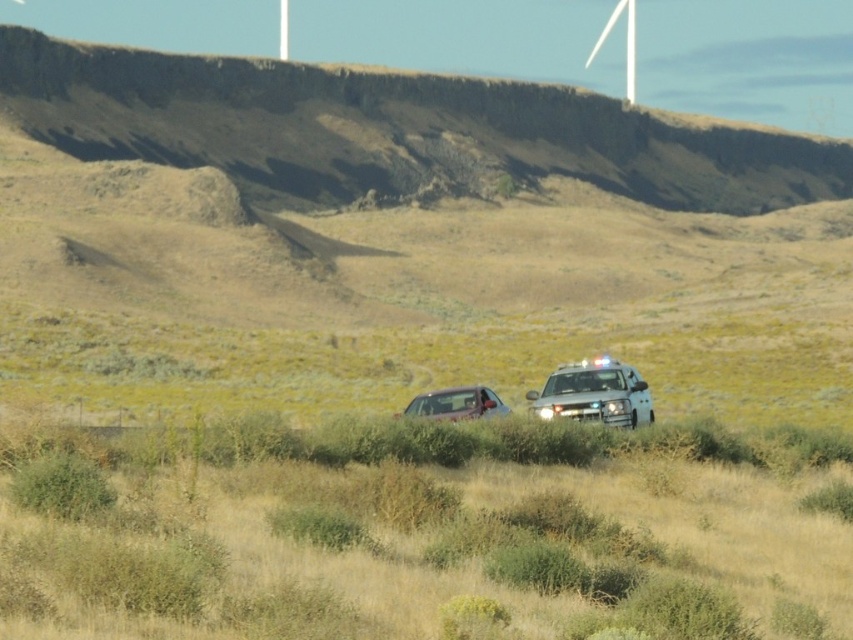
Question: Estimate the real-world distances between objects in this image. Which object is farther from the dry grass at center?

Choices:
 (A) metallic silver car at center
 (B) white glossy police car at lower right

Answer: (B)

Question: Which of these objects is positioned closest to the dry grass at center?

Choices:
 (A) white glossy police car at lower right
 (B) metallic silver car at center

Answer: (B)

Question: Can you confirm if dry grass at center is positioned to the left of metallic silver car at center?

Choices:
 (A) no
 (B) yes

Answer: (B)

Question: Considering the relative positions of dry grass at center and metallic silver car at center in the image provided, where is dry grass at center located with respect to metallic silver car at center?

Choices:
 (A) left
 (B) right

Answer: (A)

Question: Which object appears farthest from the camera in this image?

Choices:
 (A) white glossy police car at lower right
 (B) metallic silver car at center

Answer: (A)

Question: From the image, what is the correct spatial relationship of white glossy police car at lower right in relation to metallic silver car at center?

Choices:
 (A) right
 (B) left

Answer: (A)